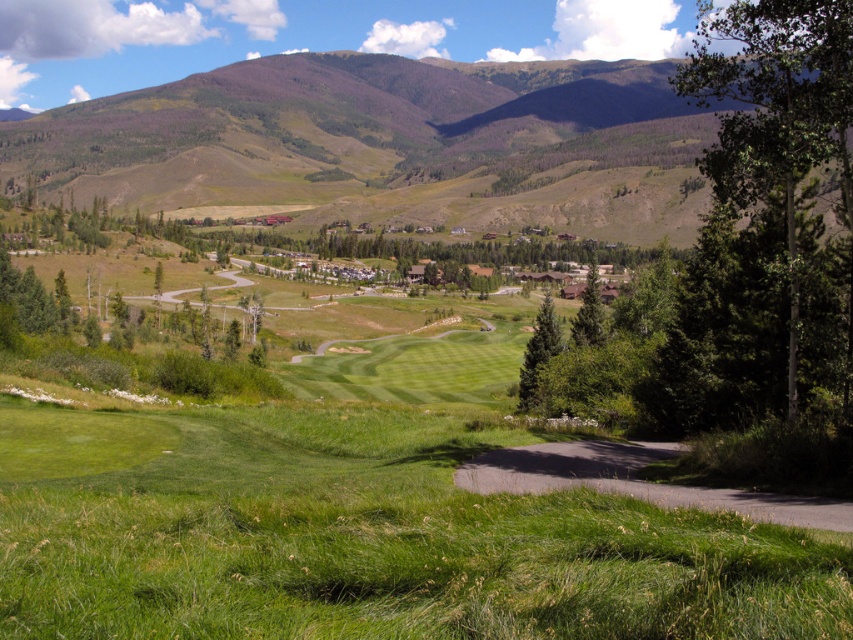
Describe the element at coordinates (363, 538) in the screenshot. I see `green grassy golf course at center` at that location.

Can you confirm if green grassy golf course at center is thinner than green leafy tree at right?

Yes, green grassy golf course at center is thinner than green leafy tree at right.

Does point (247, 620) lie behind point (788, 205)?

That is False.

Where is `green grassy golf course at center`? green grassy golf course at center is located at coordinates (363, 538).

Can you confirm if green leafy tree at right is shorter than green textured tree at center-right?

No, green leafy tree at right is not shorter than green textured tree at center-right.

Is point (779, 60) farther from viewer compared to point (596, 288)?

No, it is in front of (596, 288).

Locate an element on the screen. Image resolution: width=853 pixels, height=640 pixels. green leafy tree at right is located at coordinates (778, 116).

Locate an element on the screen. The height and width of the screenshot is (640, 853). green leafy tree at right is located at coordinates [778, 116].

Is green grassy golf course at center shorter than green grassy mountain at upper center?

Yes.

Is green grassy golf course at center taller than green grassy mountain at upper center?

No, green grassy golf course at center is not taller than green grassy mountain at upper center.

Is point (564, 579) behind point (648, 205)?

No, it is in front of (648, 205).

This screenshot has width=853, height=640. I want to click on green grassy golf course at center, so click(363, 538).